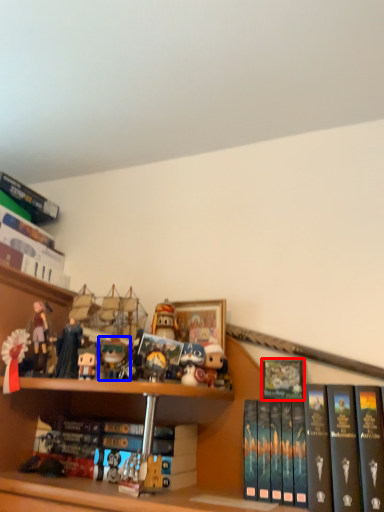
Question: Among these objects, which one is farthest to the camera, book (highlighted by a red box) or toy (highlighted by a blue box)?

Choices:
 (A) book
 (B) toy

Answer: (B)